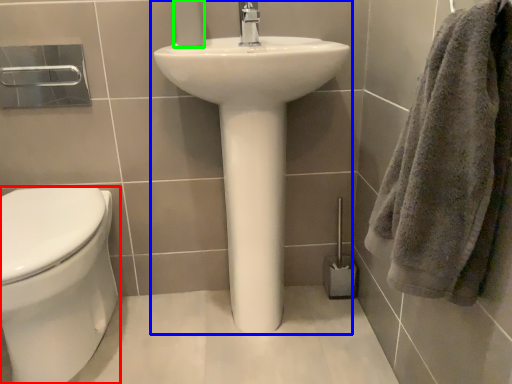
Question: Which object is positioned closest to bidet (highlighted by a red box)? Select from sink (highlighted by a blue box) and toilet paper (highlighted by a green box).

Choices:
 (A) sink
 (B) toilet paper

Answer: (A)